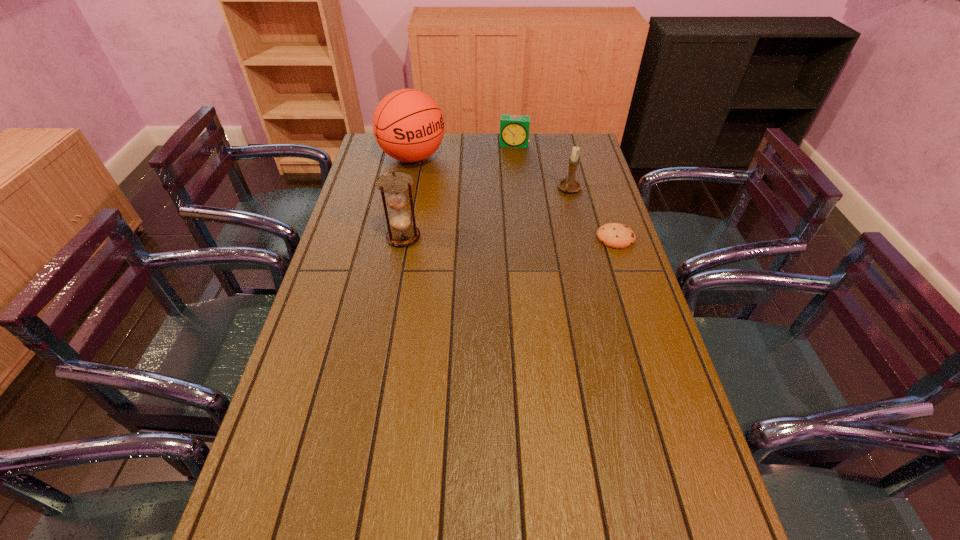
The image size is (960, 540). I want to click on vacant space on the desktop that is between the hourglass and the shortest object and is positioned on the side with logo of the basketball, so click(x=509, y=238).

Where is `vacant space on the desktop that is between the hourglass and the rightmost object and is positioned on the side of the candle holder with the handle`? vacant space on the desktop that is between the hourglass and the rightmost object and is positioned on the side of the candle holder with the handle is located at coordinates (534, 238).

I want to click on free spot on the desktop that is between the fourth shortest object and the cookie and is positioned on the front-facing side of the alarm clock, so click(x=502, y=238).